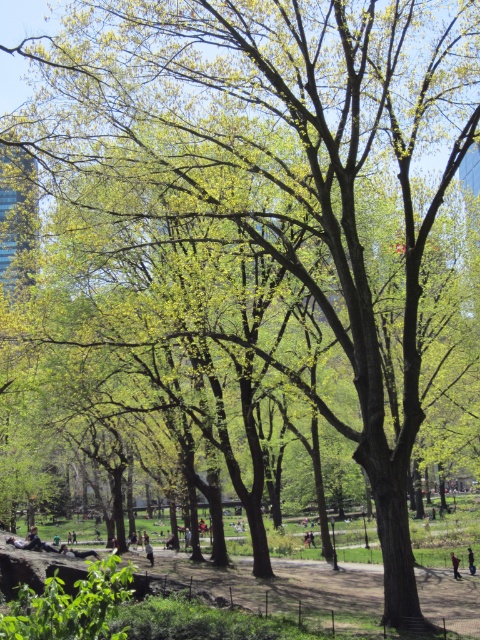
You are a photographer standing in the park and want to take a photo that includes both the green leafy trees at center and the dark blue jeans at center. Based on their positions, which object should you focus on first to ensure both are in the frame?

The green leafy trees at center is located above the dark blue jeans at center, so you should focus on the dark blue jeans at center first to ensure both are in the frame.

You are standing at the entrance of the park and want to find the green leafy trees at center. According to the 2D coordinates provided, in which direction should you walk to reach them?

The green leafy trees at center are located at coordinates point (302,595). Since the x coordinate is 0.930, which is greater than 0.5, you should walk towards the right direction. The y coordinate is 0.631, which is greater than 0.5, so you should walk forward to reach them.